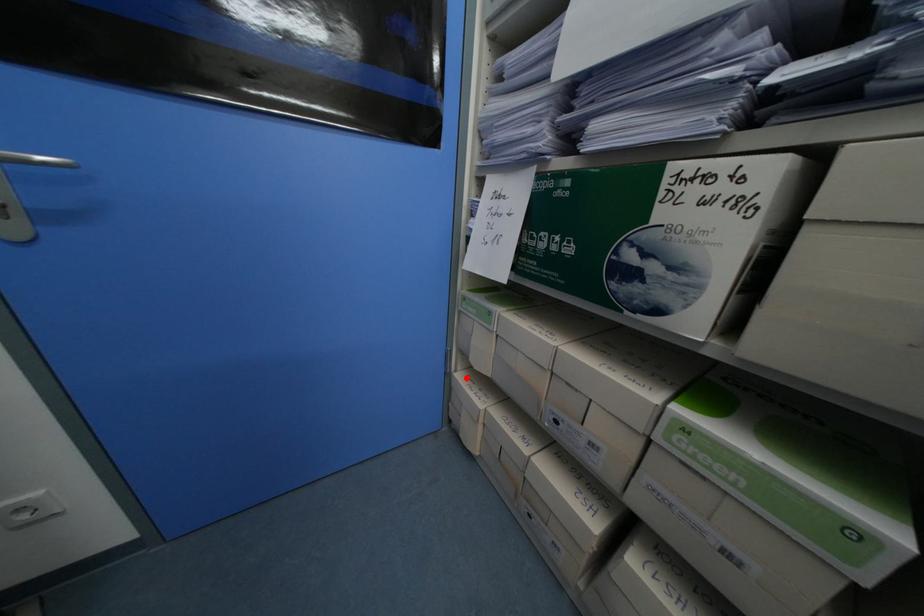
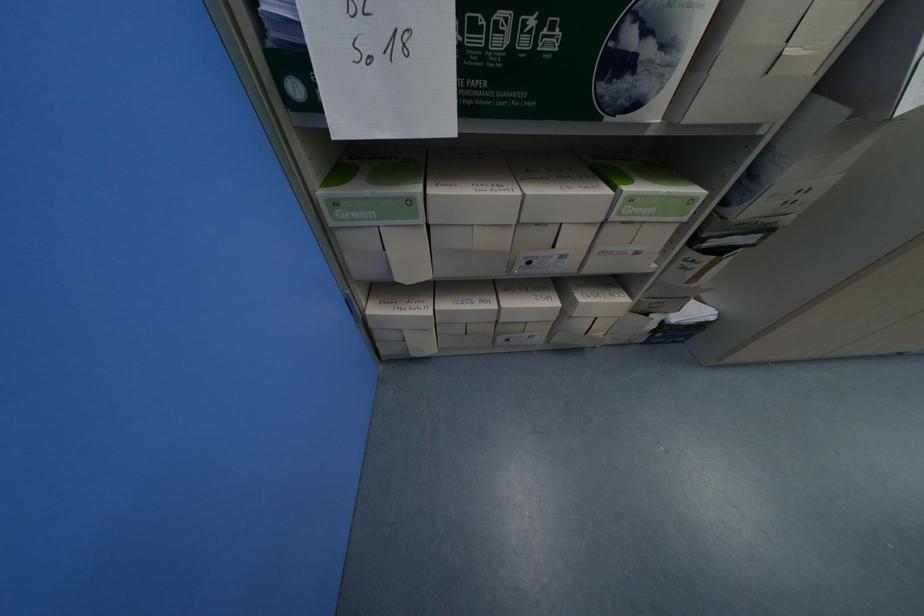
The point at the highlighted location is marked in the first image. Where is the corresponding point in the second image?

(381, 312)